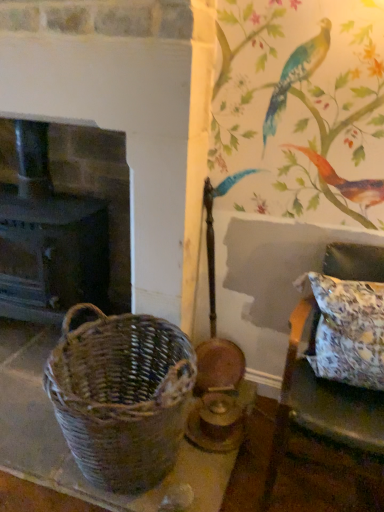
Locate an element on the screen. woven brown picnic basket at left is located at coordinates (121, 396).

Describe the element at coordinates (62, 221) in the screenshot. I see `dark brown wood fireplace at left` at that location.

Locate an element on the screen. Image resolution: width=384 pixels, height=512 pixels. floral fabric pillow at right is located at coordinates (348, 331).

From the picture: Measure the distance between point (306, 307) and camera.

A distance of 6.20 feet exists between point (306, 307) and camera.

Identify the location of woven brown picnic basket at left. The width and height of the screenshot is (384, 512). (121, 396).

Is floral fabric pillow at right to the right of dark brown wood fireplace at left from the viewer's perspective?

Yes.

Is floral fabric pillow at right looking in the opposite direction of dark brown wood fireplace at left?

That's not correct — floral fabric pillow at right is not looking away from dark brown wood fireplace at left.

Measure the distance between floral fabric pillow at right and dark brown wood fireplace at left.

The distance of floral fabric pillow at right from dark brown wood fireplace at left is 4.12 feet.

Is floral fabric pillow at right in contact with dark brown wood fireplace at left?

No, floral fabric pillow at right is not with dark brown wood fireplace at left.

Can you confirm if floral fabric pillow at right is smaller than woven brown picnic basket at left?

Yes.

Consider the image. Are floral fabric pillow at right and woven brown picnic basket at left far apart?

No.

Is floral fabric pillow at right facing away from woven brown picnic basket at left?

No, floral fabric pillow at right is not facing the opposite direction of woven brown picnic basket at left.

Is floral fabric pillow at right situated inside woven brown picnic basket at left or outside?

floral fabric pillow at right is not inside woven brown picnic basket at left, it's outside.

Does woven brown picnic basket at left have a greater height compared to dark brown wood fireplace at left?

In fact, woven brown picnic basket at left may be shorter than dark brown wood fireplace at left.

From the image's perspective, is woven brown picnic basket at left above dark brown wood fireplace at left?

No, from the image's perspective, woven brown picnic basket at left is not above dark brown wood fireplace at left.

Is woven brown picnic basket at left bigger or smaller than dark brown wood fireplace at left?

In the image, woven brown picnic basket at left appears to be smaller than dark brown wood fireplace at left.

At what (x,y) coordinates should I click in order to perform the action: click on fireplace behind the woven brown picnic basket at left. Please return your answer as a coordinate pair (x, y). The image size is (384, 512). Looking at the image, I should click on (62, 221).

How different are the orientations of dark brown wood fireplace at left and woven brown picnic basket at left in degrees?

0.000311 degrees.

Between dark brown wood fireplace at left and woven brown picnic basket at left, which one appears on the right side from the viewer's perspective?

Positioned to the right is woven brown picnic basket at left.

Looking at their sizes, would you say dark brown wood fireplace at left is wider or thinner than woven brown picnic basket at left?

Clearly, dark brown wood fireplace at left has less width compared to woven brown picnic basket at left.

Considering the sizes of objects dark brown wood fireplace at left and woven brown picnic basket at left in the image provided, who is taller, dark brown wood fireplace at left or woven brown picnic basket at left?

dark brown wood fireplace at left is taller.

In order to click on picnic basket behind the floral fabric cushion at right in this screenshot , I will do `click(121, 396)`.

Is point (360, 261) farther from camera compared to point (69, 339)?

Yes, point (360, 261) is behind point (69, 339).

Is floral fabric cushion at right facing away from woven brown picnic basket at left?

No, floral fabric cushion at right is not facing the opposite direction of woven brown picnic basket at left.

From the image's perspective, is woven brown picnic basket at left located beneath floral fabric cushion at right?

Yes.

Is point (97, 457) closer or farther from the camera than point (337, 430)?

Point (97, 457) is farther from the camera than point (337, 430).

Considering the relative sizes of woven brown picnic basket at left and floral fabric cushion at right in the image provided, is woven brown picnic basket at left wider than floral fabric cushion at right?

Incorrect, the width of woven brown picnic basket at left does not surpass that of floral fabric cushion at right.

From a real-world perspective, which is physically below, woven brown picnic basket at left or floral fabric cushion at right?

woven brown picnic basket at left is physically lower.

Can you tell me how much woven brown picnic basket at left and floral fabric pillow at right differ in facing direction?

The angle between the facing direction of woven brown picnic basket at left and the facing direction of floral fabric pillow at right is 0.00156 degrees.

Considering the relative sizes of woven brown picnic basket at left and floral fabric pillow at right in the image provided, is woven brown picnic basket at left taller than floral fabric pillow at right?

Yes, woven brown picnic basket at left is taller than floral fabric pillow at right.

Considering the positions of objects woven brown picnic basket at left and floral fabric pillow at right in the image provided, who is more to the right, woven brown picnic basket at left or floral fabric pillow at right?

floral fabric pillow at right.

Is woven brown picnic basket at left aimed at floral fabric pillow at right?

No, woven brown picnic basket at left does not turn towards floral fabric pillow at right.

Where is `fireplace above the floral fabric pillow at right (from the image's perspective)`? The image size is (384, 512). fireplace above the floral fabric pillow at right (from the image's perspective) is located at coordinates (62, 221).

Where is `picnic basket lying on the left of floral fabric pillow at right`? This screenshot has height=512, width=384. picnic basket lying on the left of floral fabric pillow at right is located at coordinates (121, 396).

Which object lies nearer to the anchor point floral fabric cushion at right, dark brown wood fireplace at left or woven brown picnic basket at left?

The object closer to floral fabric cushion at right is woven brown picnic basket at left.

Which object lies nearer to the anchor point floral fabric pillow at right, dark brown wood fireplace at left or floral fabric cushion at right?

floral fabric cushion at right is positioned closer to the anchor floral fabric pillow at right.

Looking at this image, which object lies further to the anchor point floral fabric cushion at right, floral fabric pillow at right or woven brown picnic basket at left?

woven brown picnic basket at left.

Based on their spatial positions, is floral fabric pillow at right or dark brown wood fireplace at left closer to woven brown picnic basket at left?

floral fabric pillow at right is positioned closer to the anchor woven brown picnic basket at left.

Looking at the image, which one is located closer to dark brown wood fireplace at left, woven brown picnic basket at left or floral fabric cushion at right?

woven brown picnic basket at left is closer to dark brown wood fireplace at left.

Looking at the image, which one is located closer to dark brown wood fireplace at left, floral fabric cushion at right or woven brown picnic basket at left?

The object closer to dark brown wood fireplace at left is woven brown picnic basket at left.

Looking at the image, which one is located further to floral fabric pillow at right, woven brown picnic basket at left or dark brown wood fireplace at left?

Based on the image, dark brown wood fireplace at left appears to be further to floral fabric pillow at right.

Based on their spatial positions, is woven brown picnic basket at left or floral fabric pillow at right further from dark brown wood fireplace at left?

floral fabric pillow at right.

Locate an element on the screen. The height and width of the screenshot is (512, 384). pillow between woven brown picnic basket at left and floral fabric cushion at right from left to right is located at coordinates (348, 331).

I want to click on picnic basket between dark brown wood fireplace at left and floral fabric cushion at right from left to right, so click(x=121, y=396).

Where is `picnic basket between dark brown wood fireplace at left and floral fabric pillow at right`? The width and height of the screenshot is (384, 512). picnic basket between dark brown wood fireplace at left and floral fabric pillow at right is located at coordinates (121, 396).

In order to click on pillow between dark brown wood fireplace at left and floral fabric cushion at right in the horizontal direction in this screenshot , I will do `click(348, 331)`.